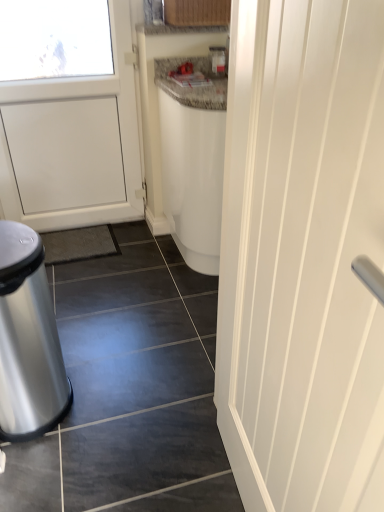
Question: Is polished metallic trash can at lower left turned away from white smooth door at right?

Choices:
 (A) no
 (B) yes

Answer: (A)

Question: Are polished metallic trash can at lower left and white smooth door at right located far from each other?

Choices:
 (A) no
 (B) yes

Answer: (A)

Question: Is polished metallic trash can at lower left touching white smooth door at right?

Choices:
 (A) no
 (B) yes

Answer: (A)

Question: Does polished metallic trash can at lower left have a greater width compared to white smooth door at right?

Choices:
 (A) no
 (B) yes

Answer: (B)

Question: Does polished metallic trash can at lower left appear on the left side of white smooth door at right?

Choices:
 (A) yes
 (B) no

Answer: (A)

Question: Considering the relative sizes of polished metallic trash can at lower left and white smooth door at right in the image provided, is polished metallic trash can at lower left shorter than white smooth door at right?

Choices:
 (A) yes
 (B) no

Answer: (A)

Question: Can you confirm if white smooth door at right is shorter than polished metallic trash can at lower left?

Choices:
 (A) no
 (B) yes

Answer: (A)

Question: Considering the relative positions of white smooth door at right and polished metallic trash can at lower left in the image provided, is white smooth door at right to the right of polished metallic trash can at lower left from the viewer's perspective?

Choices:
 (A) yes
 (B) no

Answer: (A)

Question: Is white smooth door at right closer to the viewer compared to polished metallic trash can at lower left?

Choices:
 (A) no
 (B) yes

Answer: (B)

Question: Could polished metallic trash can at lower left be considered to be inside white smooth door at right?

Choices:
 (A) yes
 (B) no

Answer: (B)

Question: Considering the relative sizes of white smooth door at right and polished metallic trash can at lower left in the image provided, is white smooth door at right wider than polished metallic trash can at lower left?

Choices:
 (A) no
 (B) yes

Answer: (A)

Question: From the image's perspective, is white smooth door at right on polished metallic trash can at lower left?

Choices:
 (A) yes
 (B) no

Answer: (A)

Question: From the image's perspective, relative to polished metallic trash can at lower left, is white smooth door at right above or below?

Choices:
 (A) above
 (B) below

Answer: (A)